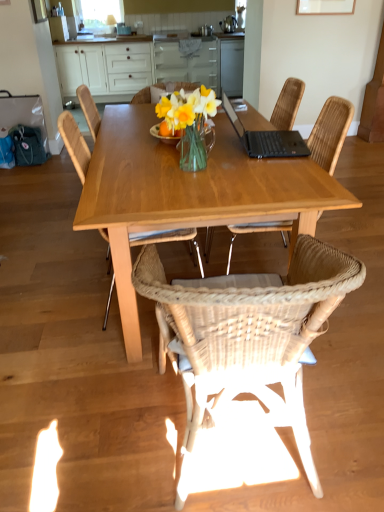
Question: In which direction should I rotate to look at transparent glass window screen at upper center?

Choices:
 (A) right
 (B) left

Answer: (B)

Question: From a real-world perspective, is woven rattan chair at center, which is counted as the 2th chair, starting from the right, below wooden table at center?

Choices:
 (A) no
 (B) yes

Answer: (A)

Question: Considering the relative sizes of woven rattan chair at center, arranged as the 2th chair when viewed from the left, and wooden table at center in the image provided, is woven rattan chair at center, arranged as the 2th chair when viewed from the left, smaller than wooden table at center?

Choices:
 (A) yes
 (B) no

Answer: (A)

Question: From the image's perspective, would you say woven rattan chair at center, arranged as the 2th chair when viewed from the left, is positioned over wooden table at center?

Choices:
 (A) yes
 (B) no

Answer: (B)

Question: Does woven rattan chair at center, which is counted as the 2th chair, starting from the right, come behind wooden table at center?

Choices:
 (A) no
 (B) yes

Answer: (A)

Question: Considering the relative positions of woven rattan chair at center, which is counted as the 2th chair, starting from the right, and wooden table at center in the image provided, is woven rattan chair at center, which is counted as the 2th chair, starting from the right, to the right of wooden table at center from the viewer's perspective?

Choices:
 (A) yes
 (B) no

Answer: (A)

Question: Is woven rattan chair at center, arranged as the 2th chair when viewed from the left, surrounding wooden table at center?

Choices:
 (A) yes
 (B) no

Answer: (B)

Question: Is the depth of woven wood chair at center, positioned as the first chair in left-to-right order, greater than that of wooden table at center?

Choices:
 (A) no
 (B) yes

Answer: (B)

Question: Is woven wood chair at center, positioned as the first chair in left-to-right order, at the right side of wooden table at center?

Choices:
 (A) no
 (B) yes

Answer: (A)

Question: Is woven wood chair at center, positioned as the first chair in left-to-right order, wider than wooden table at center?

Choices:
 (A) yes
 (B) no

Answer: (B)

Question: From a real-world perspective, is woven wood chair at center, positioned as the first chair in left-to-right order, positioned under wooden table at center based on gravity?

Choices:
 (A) yes
 (B) no

Answer: (B)

Question: Is wooden table at center inside woven wood chair at center, which is the 3th chair from right to left?

Choices:
 (A) no
 (B) yes

Answer: (A)

Question: From a real-world perspective, is woven wood chair at center, which is the 3th chair from right to left, on wooden table at center?

Choices:
 (A) yes
 (B) no

Answer: (A)

Question: Is woven rattan chair at center, which is counted as the 2th chair, starting from the right, surrounded by woven wood chair at center, positioned as the first chair in left-to-right order?

Choices:
 (A) yes
 (B) no

Answer: (B)